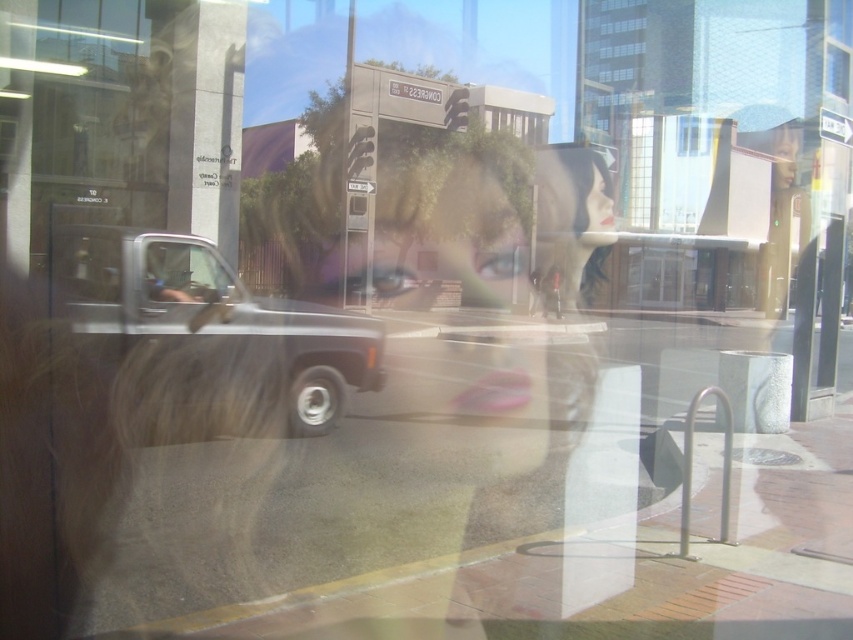
You are a delivery person trying to park your silver metallic truck at center as close as possible to the clear glass window at center without touching it. What is the closest distance you can park the truck to the window?

The closest distance you can park the silver metallic truck at center to the clear glass window at center is 4.25 feet, as that is the minimum distance between them according to the scene description.

You are a delivery driver who needs to park your truck. You see the silver metallic truck at center and the clear glass window at center in the image. Which object is positioned to the right side of the other?

The silver metallic truck at center is to the left of the clear glass window at center, so the clear glass window at center is positioned to the right side of the silver metallic truck at center.